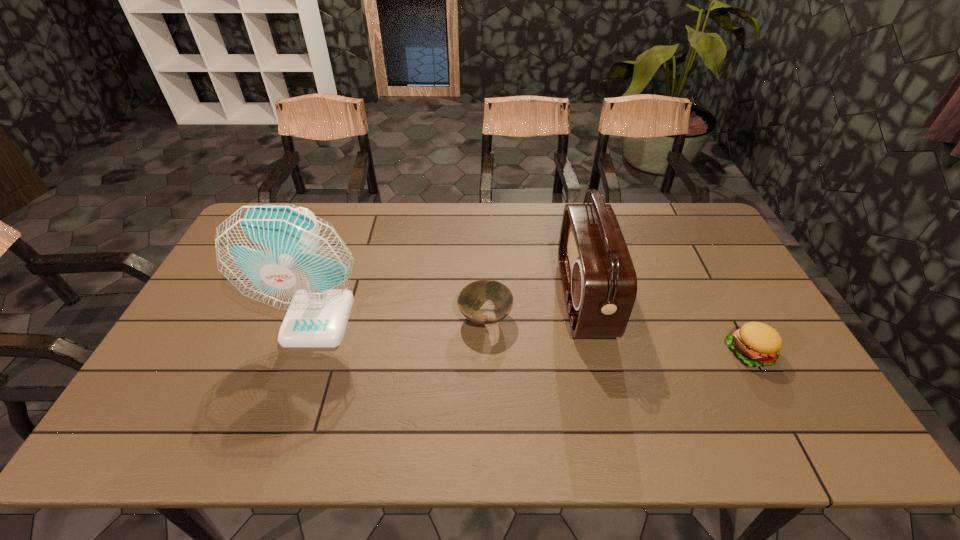
The width and height of the screenshot is (960, 540). Find the location of `vacant space that satisfies the following two spatial constraints: 1. on the front panel of the second tallest object; 2. on the back side of the rightmost object`. vacant space that satisfies the following two spatial constraints: 1. on the front panel of the second tallest object; 2. on the back side of the rightmost object is located at coordinates (597, 352).

Find the location of a particular element. The width and height of the screenshot is (960, 540). blank area in the image that satisfies the following two spatial constraints: 1. in front of the rightmost object to face the airflow; 2. on the right side of the fan is located at coordinates (307, 352).

Identify the location of free spot that satisfies the following two spatial constraints: 1. on the front panel of the third object from left to right; 2. on the back side of the rightmost object. (597, 352).